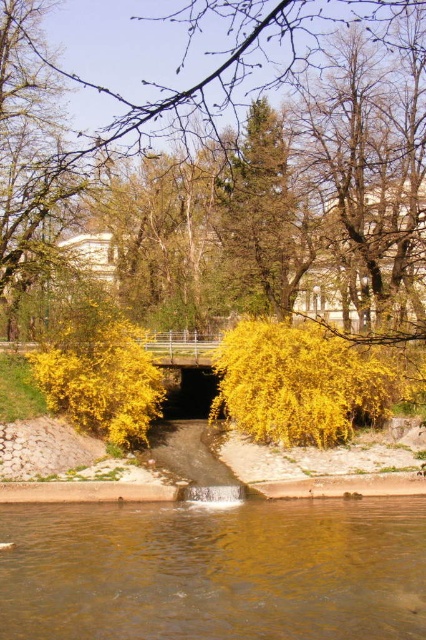
Question: In this image, where is brown liquid water at lower center located relative to yellow leafy tree at center?

Choices:
 (A) left
 (B) right

Answer: (B)

Question: Among these objects, which one is nearest to the camera?

Choices:
 (A) yellow leafy tree at center
 (B) brown liquid water at lower center

Answer: (A)

Question: Does brown liquid water at lower center appear on the left side of yellow leafy tree at center?

Choices:
 (A) no
 (B) yes

Answer: (A)

Question: Is brown liquid water at lower center smaller than yellow leafy tree at center?

Choices:
 (A) yes
 (B) no

Answer: (A)

Question: Among these objects, which one is farthest from the camera?

Choices:
 (A) yellow leafy tree at center
 (B) brown liquid water at lower center

Answer: (B)